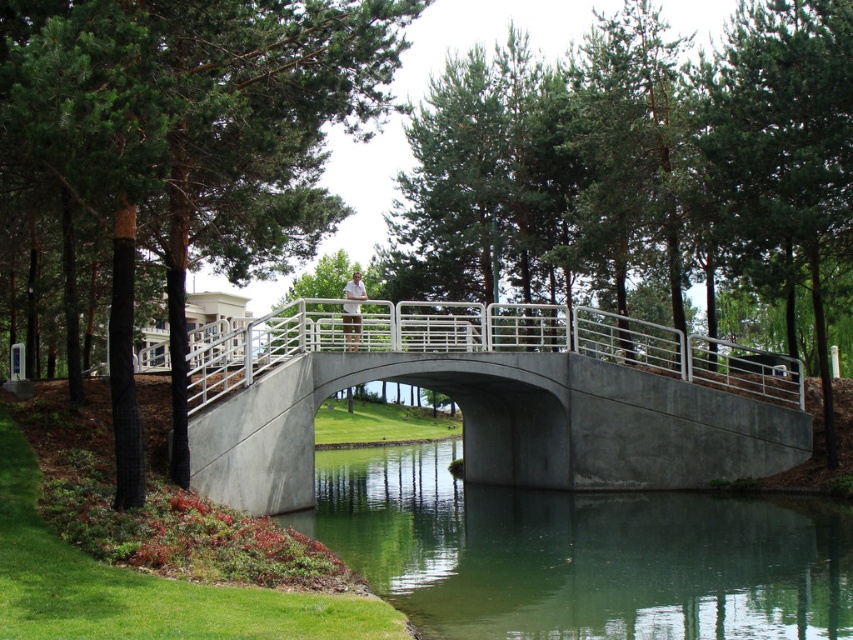
You are a drone operator trying to capture a photo of the concrete bridge at center. The camera is currently positioned at point A. To ensure the bridge is centered in the frame, should you move the camera closer to or further away from the bridge? Please provide your reasoning based on the coordinates provided.

The concrete bridge at center is located at coordinates point A. Since the camera is already at point A, no adjustment is needed to center the bridge in the frame.

You are a drone operator planning to fly a drone over the concrete bridge at center and the green smooth water at center. Given that the drone has a maximum flight altitude of 1 meter, will it be able to pass safely between the two objects without hitting either?

The concrete bridge at center is taller than the green smooth water at center. Since the drone has a maximum flight altitude of 1 meter, it needs to ensure that the space between the two objects is at least 1 meter in height. However, the description only states the relative height between the two objects but does not provide specific measurements. Therefore, it is unclear if the drone can safely pass without additional information about the actual height difference.

Based on the photo, you are a drone operator planning to fly a drone over the green leafy tree at upper center and the green smooth water at center. According to the scene description, which object is positioned higher from the ground?

The green leafy tree at upper center is located above the green smooth water at center, so it is positioned higher from the ground.